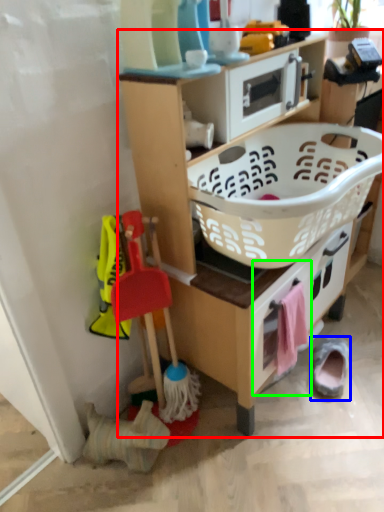
Question: Which object is positioned farthest from shelf (highlighted by a red box)? Select from footwear (highlighted by a blue box) and drawer (highlighted by a green box).

Choices:
 (A) footwear
 (B) drawer

Answer: (A)